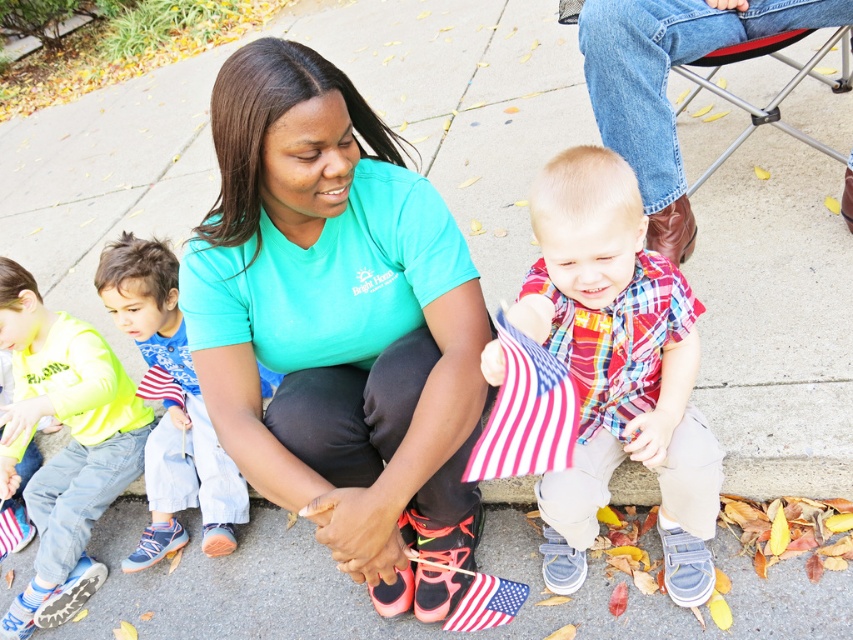
Is teal matte shirt at center closer to camera compared to plaid cotton shirt at center?

That is False.

Locate an element on the screen. The image size is (853, 640). teal matte shirt at center is located at coordinates (338, 323).

Find the location of a particular element. teal matte shirt at center is located at coordinates (338, 323).

What do you see at coordinates (65, 445) in the screenshot? The height and width of the screenshot is (640, 853). I see `neon yellow shirt at left` at bounding box center [65, 445].

Is neon yellow shirt at left bigger than blue denim pants at left?

Yes.

This screenshot has width=853, height=640. Find the location of `neon yellow shirt at left`. neon yellow shirt at left is located at coordinates (65, 445).

Between point (207, 272) and point (201, 406), which one is positioned behind?

Point (201, 406)

At what (x,y) coordinates should I click in order to perform the action: click on teal matte shirt at center. Please return your answer as a coordinate pair (x, y). Image resolution: width=853 pixels, height=640 pixels. Looking at the image, I should click on (338, 323).